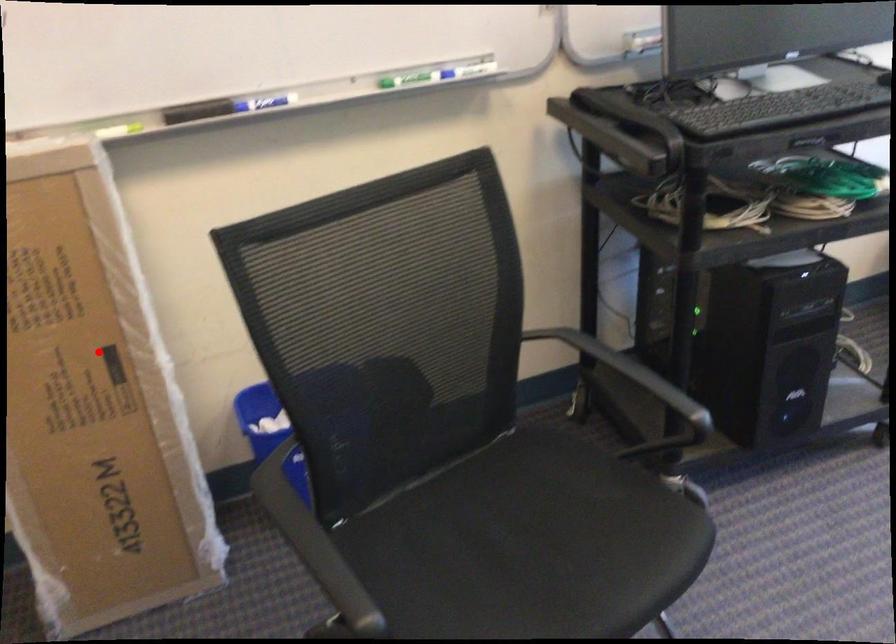
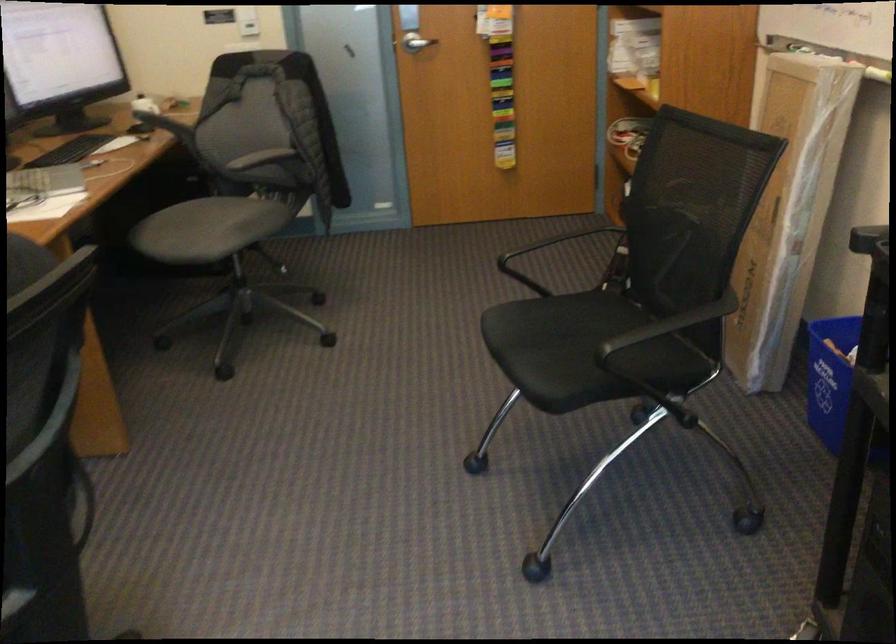
Find the pixel in the second image that matches the highlighted location in the first image.

(788, 212)